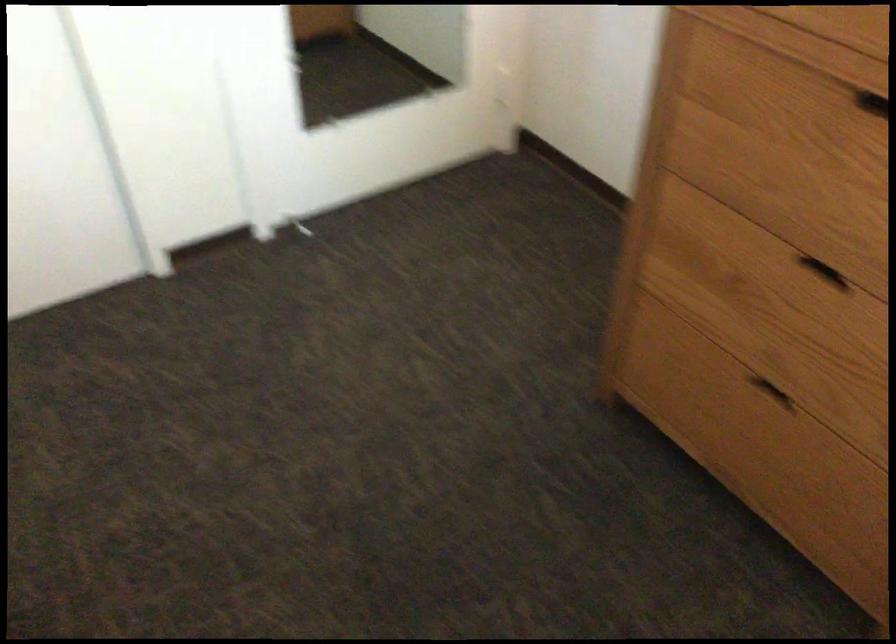
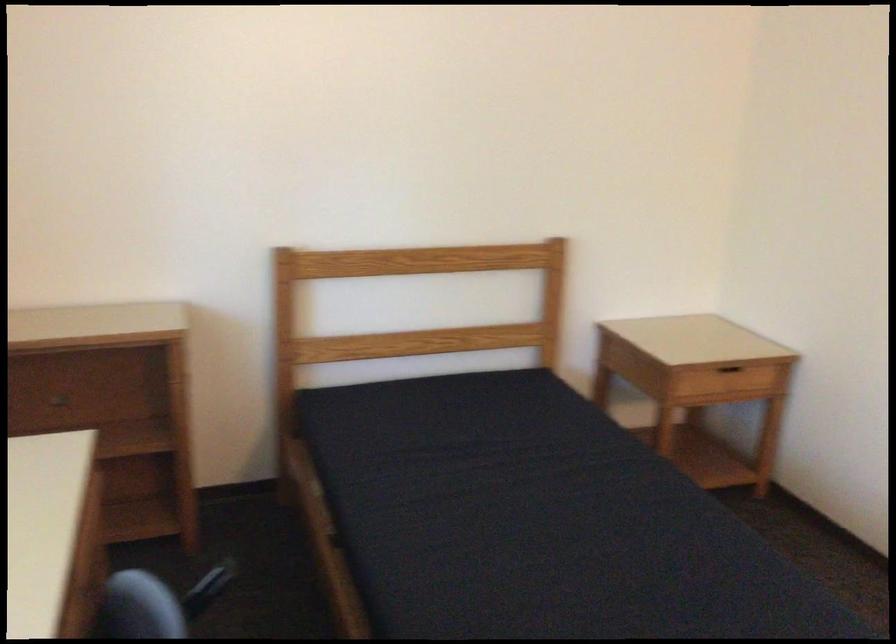
Based on the photo, the first image is from the beginning of the video and the second image is from the end. How did the camera likely rotate when shooting the video?

The camera rotated toward left-down.